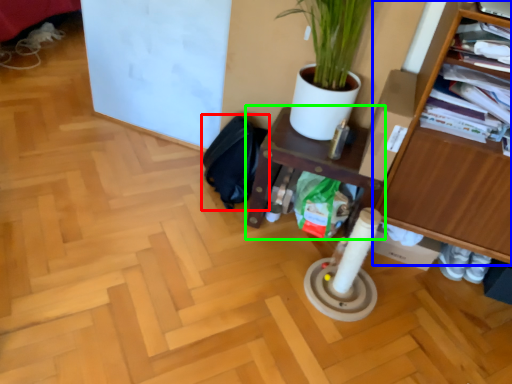
Question: Considering the real-world distances, which object is closest to swivel chair (highlighted by a red box)? furniture (highlighted by a blue box) or shelf (highlighted by a green box).

Choices:
 (A) furniture
 (B) shelf

Answer: (B)